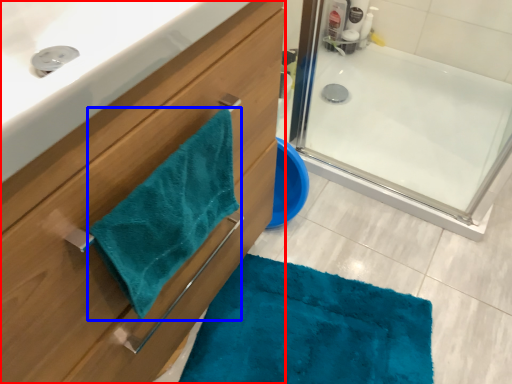
Question: Which of the following is the farthest to the observer, bathroom cabinet (highlighted by a red box) or beach towel (highlighted by a blue box)?

Choices:
 (A) bathroom cabinet
 (B) beach towel

Answer: (B)